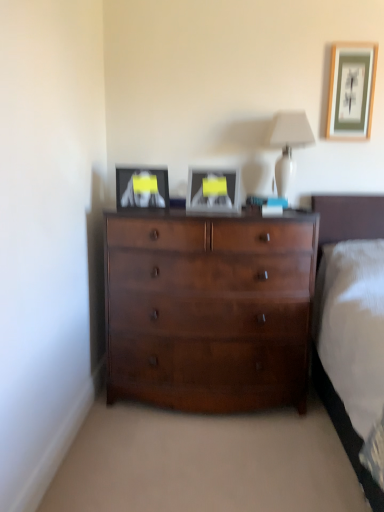
Question: Does matte black picture frame at upper left, which is the first picture frame from bottom to top, lie behind shiny brown dresser at center?

Choices:
 (A) yes
 (B) no

Answer: (A)

Question: Is matte black picture frame at upper left, marked as the third picture frame in a top-to-bottom arrangement, to the left of shiny brown dresser at center from the viewer's perspective?

Choices:
 (A) yes
 (B) no

Answer: (A)

Question: Would you consider matte black picture frame at upper left, which is the first picture frame from bottom to top, to be distant from shiny brown dresser at center?

Choices:
 (A) no
 (B) yes

Answer: (A)

Question: Could you tell me if matte black picture frame at upper left, which is the first picture frame from bottom to top, is facing shiny brown dresser at center?

Choices:
 (A) yes
 (B) no

Answer: (B)

Question: Is matte black picture frame at upper left, arranged as the first picture frame when viewed from the left, turned away from shiny brown dresser at center?

Choices:
 (A) yes
 (B) no

Answer: (B)

Question: Can you confirm if matte black picture frame at upper left, which is the first picture frame from bottom to top, is smaller than shiny brown dresser at center?

Choices:
 (A) yes
 (B) no

Answer: (A)

Question: Is wooden framed artwork at upper right, the 3th picture frame when ordered from bottom to top, behind matte black picture frame at upper left, marked as the third picture frame in a top-to-bottom arrangement?

Choices:
 (A) no
 (B) yes

Answer: (B)

Question: Are wooden framed artwork at upper right, the third picture frame in the left-to-right sequence, and matte black picture frame at upper left, the third picture frame when ordered from right to left, beside each other?

Choices:
 (A) no
 (B) yes

Answer: (A)

Question: Is wooden framed artwork at upper right, the first picture frame viewed from the right, thinner than matte black picture frame at upper left, arranged as the first picture frame when viewed from the left?

Choices:
 (A) no
 (B) yes

Answer: (B)

Question: From a real-world perspective, is wooden framed artwork at upper right, the first picture frame viewed from the right, on matte black picture frame at upper left, marked as the third picture frame in a top-to-bottom arrangement?

Choices:
 (A) yes
 (B) no

Answer: (A)

Question: Considering the relative sizes of wooden framed artwork at upper right, the first picture frame viewed from the right, and matte black picture frame at upper left, arranged as the first picture frame when viewed from the left, in the image provided, is wooden framed artwork at upper right, the first picture frame viewed from the right, smaller than matte black picture frame at upper left, arranged as the first picture frame when viewed from the left,?

Choices:
 (A) no
 (B) yes

Answer: (B)

Question: From a real-world perspective, does wooden framed artwork at upper right, the 3th picture frame when ordered from bottom to top, sit lower than matte black picture frame at upper left, the third picture frame when ordered from right to left?

Choices:
 (A) yes
 (B) no

Answer: (B)

Question: From the image's perspective, is matte black picture frame at upper left, arranged as the first picture frame when viewed from the left, under white glossy table lamp at upper center?

Choices:
 (A) yes
 (B) no

Answer: (A)